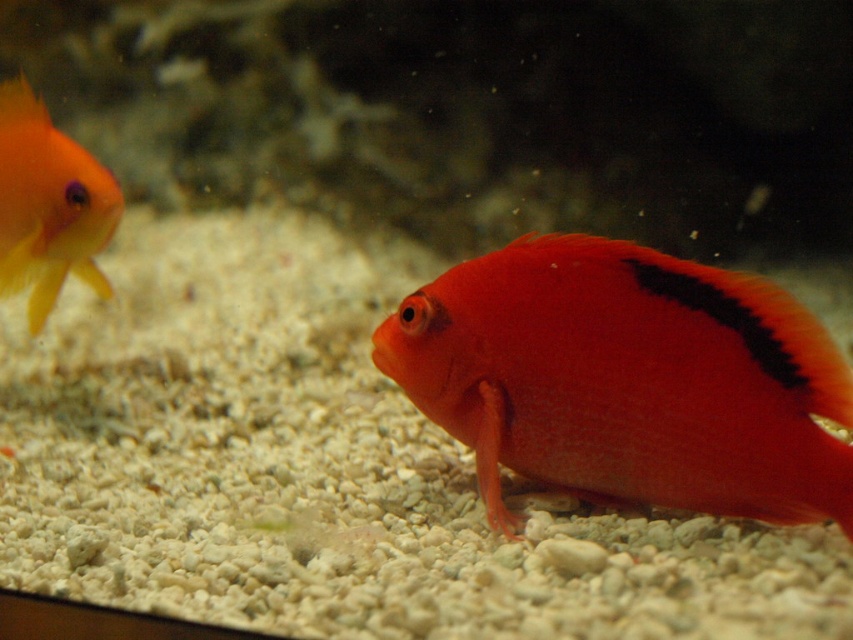
Is point (799, 470) more distant than point (22, 92)?

No, it is not.

Between shiny orange fish at center and matte orange goldfish at left, which one appears on the left side from the viewer's perspective?

matte orange goldfish at left is more to the left.

Is point (567, 394) positioned after point (32, 104)?

No, it is not.

Image resolution: width=853 pixels, height=640 pixels. I want to click on shiny orange fish at center, so click(x=628, y=380).